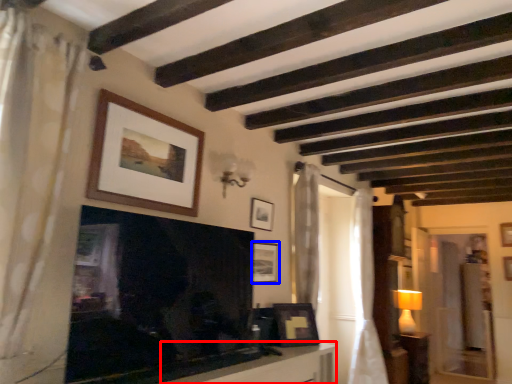
Question: Which point is closer to the camera, table (highlighted by a red box) or picture frame (highlighted by a blue box)?

Choices:
 (A) table
 (B) picture frame

Answer: (A)